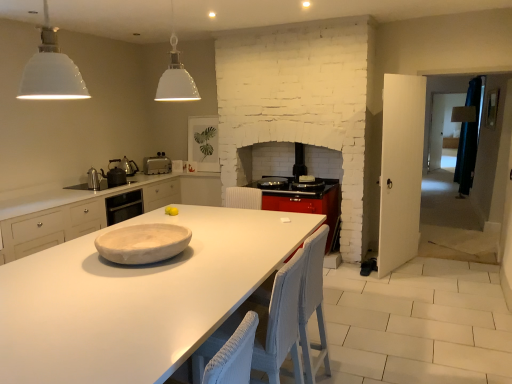
Question: Is white wicker chair at center, the first chair from the front, spatially inside metallic silver kettle at left, acting as the third appliance starting from the front, or outside of it?

Choices:
 (A) inside
 (B) outside

Answer: (B)

Question: From the image's perspective, relative to metallic silver kettle at left, acting as the third appliance starting from the front, is white wicker chair at center, acting as the second chair starting from the back, above or below?

Choices:
 (A) above
 (B) below

Answer: (B)

Question: Considering the real-world distances, which object is closest to the white marble platter at center?

Choices:
 (A) white wicker chair at center, acting as the second chair starting from the back
 (B) silver metallic toaster at center, the first appliance when ordered from back to front
 (C) white matte pendant light at upper left, acting as the 2th light fixture starting from the right
 (D) metallic silver kettle at left, acting as the third appliance starting from the front
 (E) metallic silver kettle at left, positioned as the first appliance in front-to-back order

Answer: (A)

Question: Estimate the real-world distances between objects in this image. Which object is farther from the white matte pendant light at upper left, acting as the 2th light fixture starting from the right?

Choices:
 (A) metallic silver kettle at left, which is the fourth appliance from back to front
 (B) white woven chair at center, placed as the first chair when sorted from back to front
 (C) metallic silver kettle at left, which is the 2th appliance from back to front
 (D) white matte countertop at center
 (E) white wicker chair at center, acting as the second chair starting from the back

Answer: (C)